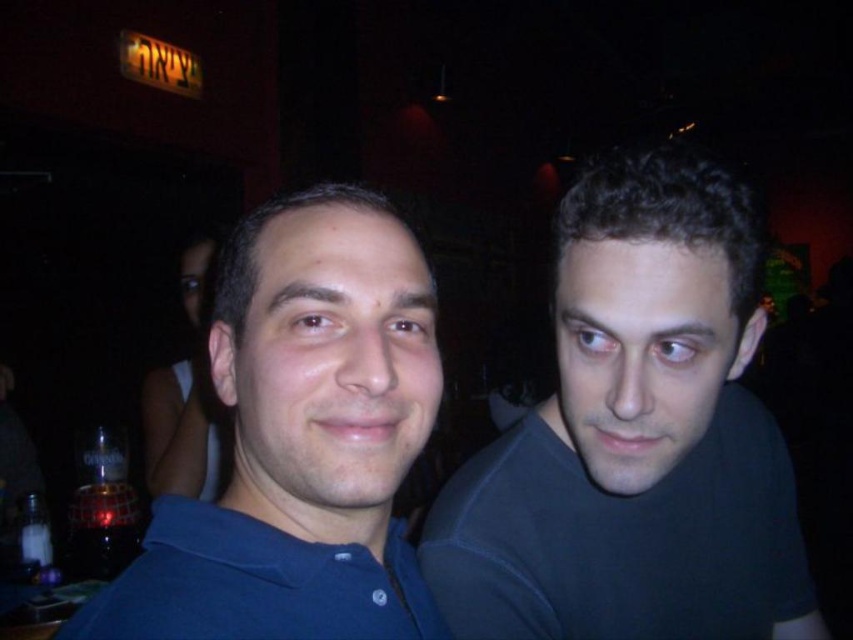
Is dark blue shirt at right thinner than blue matte shirt at center?

No, dark blue shirt at right is not thinner than blue matte shirt at center.

Is dark blue shirt at right closer to camera compared to blue matte shirt at center?

No, it is not.

Is point (583, 216) farther from camera compared to point (389, 394)?

Yes.

At what (x,y) coordinates should I click in order to perform the action: click on dark blue shirt at right. Please return your answer as a coordinate pair (x, y). Looking at the image, I should click on (635, 436).